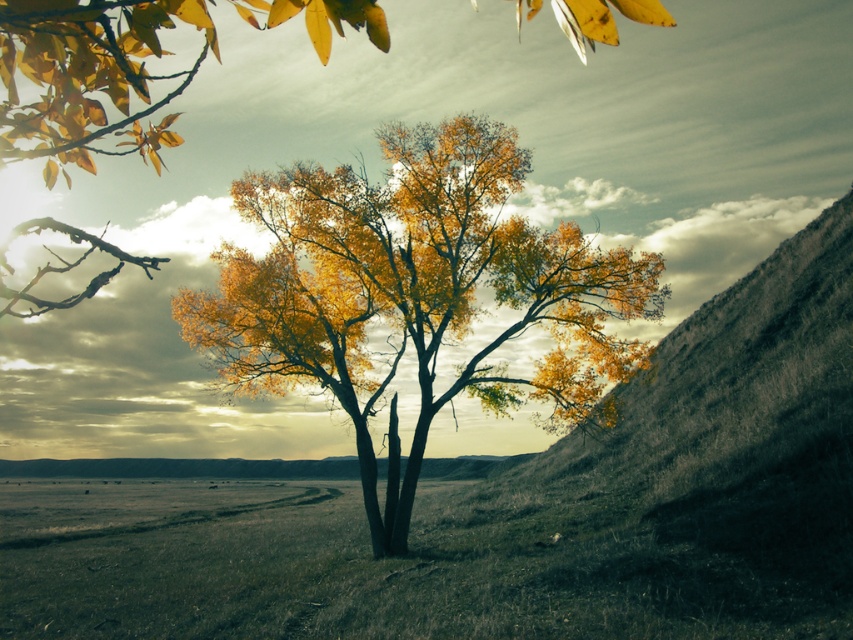
Question: Among these objects, which one is farthest from the camera?

Choices:
 (A) golden textured tree at center
 (B) yellow-green foliage at center

Answer: (A)

Question: Does golden textured tree at center appear on the left side of yellow-green foliage at center?

Choices:
 (A) yes
 (B) no

Answer: (B)

Question: Which of the following is the closest to the observer?

Choices:
 (A) (155, 172)
 (B) (476, 262)

Answer: (A)

Question: Which of the following is the farthest from the observer?

Choices:
 (A) (428, 212)
 (B) (148, 74)

Answer: (A)

Question: Is golden textured tree at center thinner than yellow-green foliage at center?

Choices:
 (A) no
 (B) yes

Answer: (B)

Question: Is golden textured tree at center wider than yellow-green foliage at center?

Choices:
 (A) yes
 (B) no

Answer: (B)